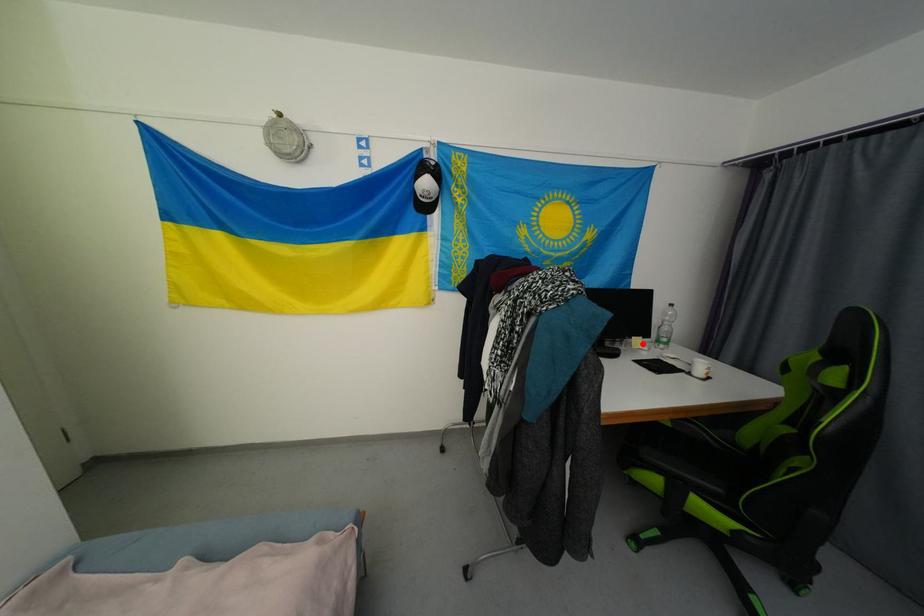
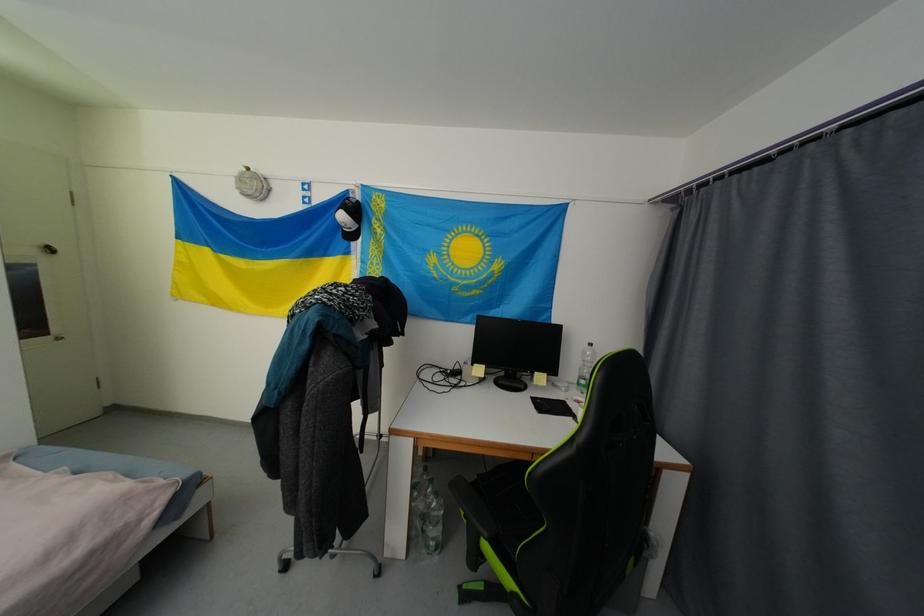
In the second image, find the point that corresponds to the highlighted location in the first image.

(545, 379)